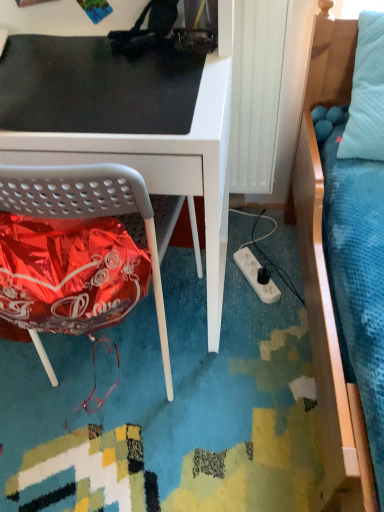
Question: Is white plastic power outlet at lower center further to camera compared to white matte desk at center?

Choices:
 (A) no
 (B) yes

Answer: (B)

Question: Considering the relative positions of white plastic power outlet at lower center and white matte desk at center in the image provided, is white plastic power outlet at lower center to the right of white matte desk at center from the viewer's perspective?

Choices:
 (A) yes
 (B) no

Answer: (A)

Question: From a real-world perspective, is white plastic power outlet at lower center under white matte desk at center?

Choices:
 (A) yes
 (B) no

Answer: (A)

Question: From the image's perspective, would you say white plastic power outlet at lower center is shown under white matte desk at center?

Choices:
 (A) yes
 (B) no

Answer: (A)

Question: Is white plastic power outlet at lower center next to white matte desk at center and touching it?

Choices:
 (A) yes
 (B) no

Answer: (B)

Question: From the image's perspective, is white matte desk at center positioned above or below black matte mousepad at upper left?

Choices:
 (A) below
 (B) above

Answer: (A)

Question: In terms of height, does white matte desk at center look taller or shorter compared to black matte mousepad at upper left?

Choices:
 (A) tall
 (B) short

Answer: (A)

Question: Considering their positions, is white matte desk at center located in front of or behind black matte mousepad at upper left?

Choices:
 (A) behind
 (B) front

Answer: (B)

Question: Is white matte desk at center wider or thinner than black matte mousepad at upper left?

Choices:
 (A) wide
 (B) thin

Answer: (A)

Question: From a real-world perspective, is white matte desk at center physically located above or below white plastic power outlet at lower center?

Choices:
 (A) below
 (B) above

Answer: (B)

Question: Considering the positions of white matte desk at center and white plastic power outlet at lower center in the image, is white matte desk at center bigger or smaller than white plastic power outlet at lower center?

Choices:
 (A) small
 (B) big

Answer: (B)

Question: Does point (172, 130) appear closer or farther from the camera than point (261, 297)?

Choices:
 (A) closer
 (B) farther

Answer: (A)

Question: Would you say white matte desk at center is to the left or to the right of white plastic power outlet at lower center in the picture?

Choices:
 (A) right
 (B) left

Answer: (B)

Question: Is black matte mousepad at upper left in front of or behind white plastic power outlet at lower center in the image?

Choices:
 (A) front
 (B) behind

Answer: (A)

Question: Is point (31, 36) closer or farther from the camera than point (240, 262)?

Choices:
 (A) farther
 (B) closer

Answer: (B)